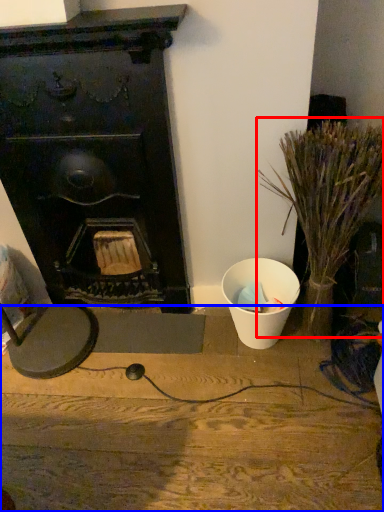
Question: Which object appears closest to the camera in this image, plant (highlighted by a red box) or furniture (highlighted by a blue box)?

Choices:
 (A) plant
 (B) furniture

Answer: (A)